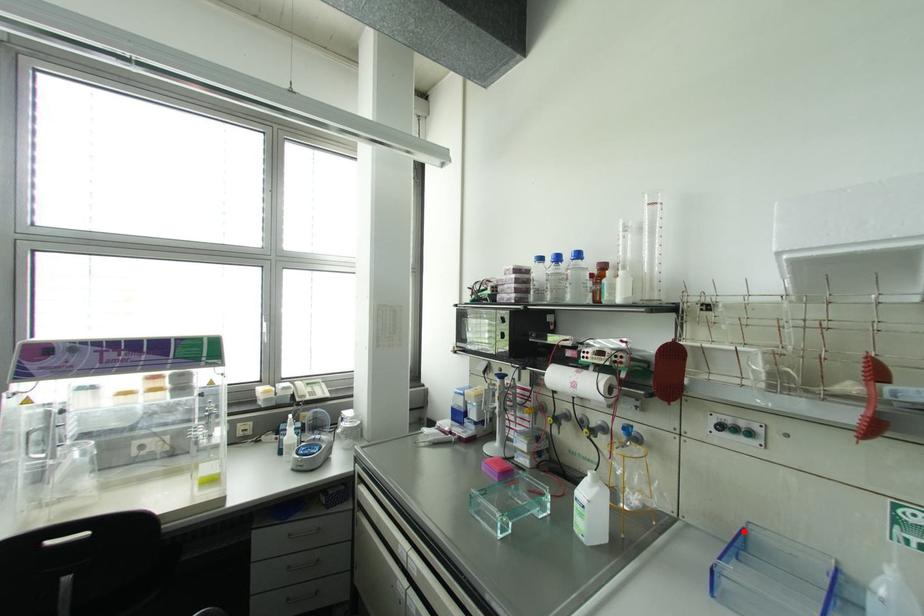
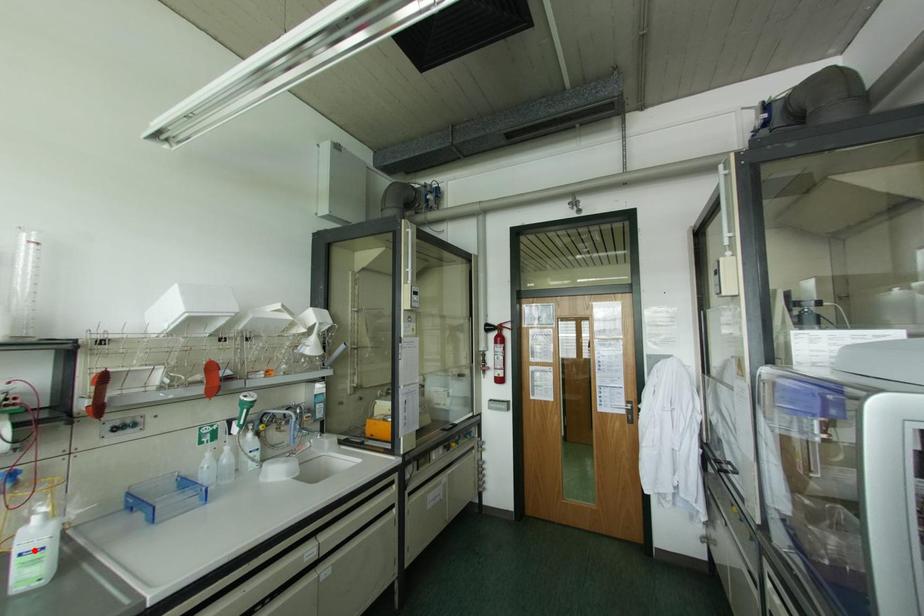
I am providing you with two images of the same scene from different viewpoints. A red point is marked on the first image and another point is marked on the second image. Is the red point in image1 aligned with the point shown in image2?

No